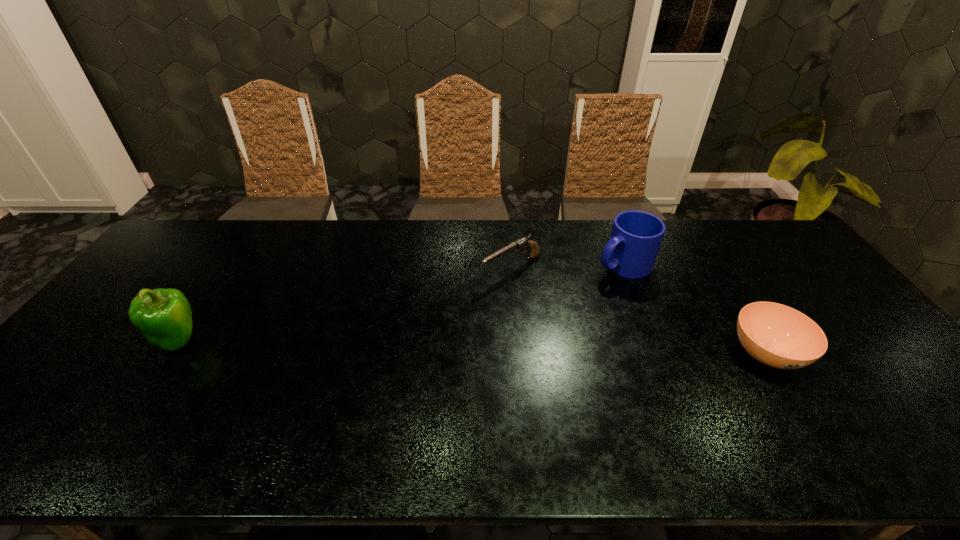
The image size is (960, 540). I want to click on vacant space on the desktop that is between the leftmost object and the rightmost object and is positioned aiming along the barrel of the gun, so click(384, 345).

The height and width of the screenshot is (540, 960). In order to click on free space on the desktop that is between the leftmost object and the soup bowl and is positioned on the side with the handle of the third object from left to right in this screenshot , I will do `click(465, 347)`.